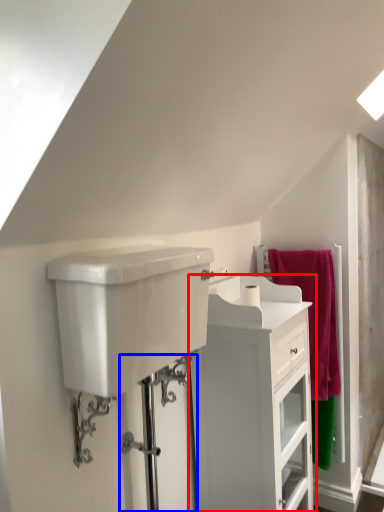
Question: Which object is closer to the camera taking this photo, bathroom cabinet (highlighted by a red box) or shower door (highlighted by a blue box)?

Choices:
 (A) bathroom cabinet
 (B) shower door

Answer: (B)